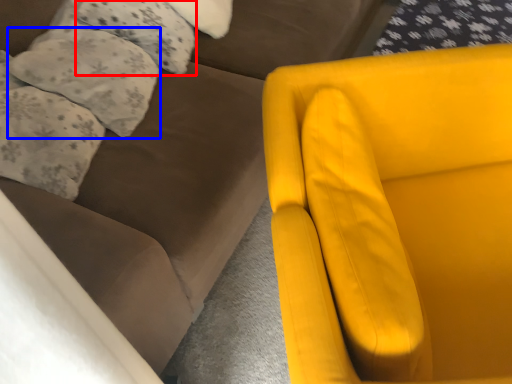
Question: Which object appears farthest to the camera in this image, pillow (highlighted by a red box) or pillow (highlighted by a blue box)?

Choices:
 (A) pillow
 (B) pillow

Answer: (A)